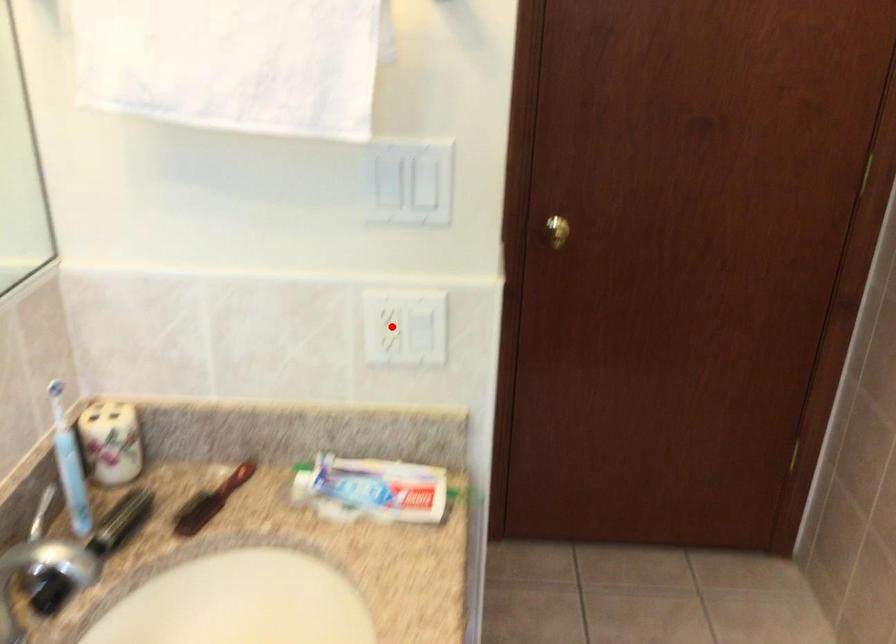
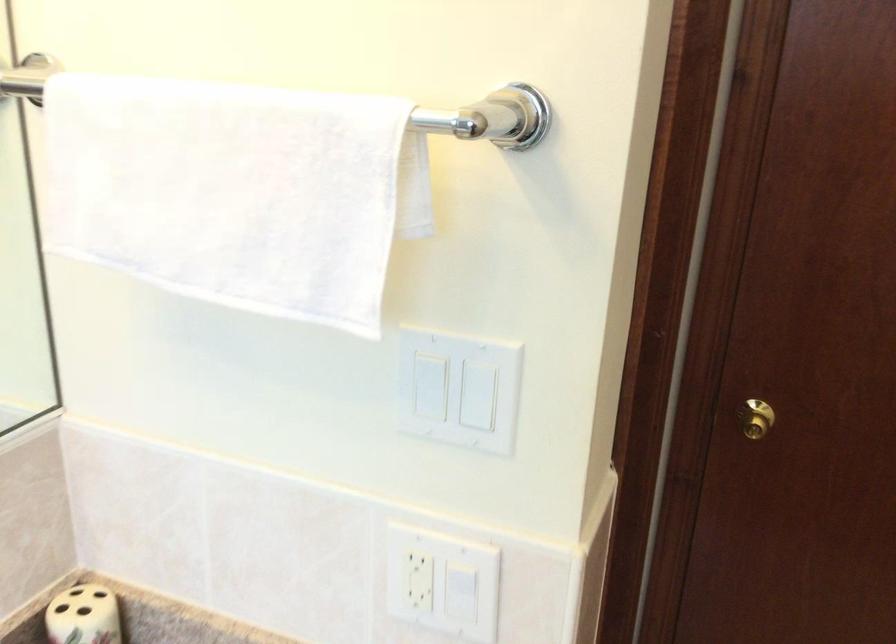
In the second image, find the point that corresponds to the highlighted location in the first image.

(429, 581)